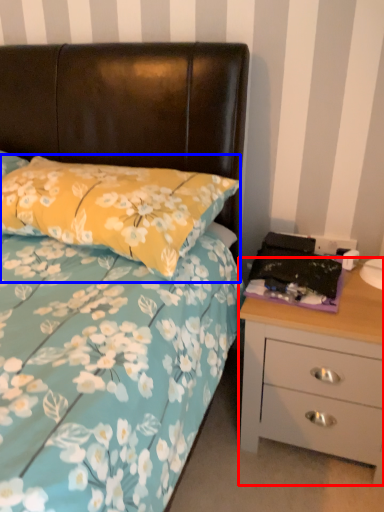
Question: Which object is further to the camera taking this photo, chest of drawers (highlighted by a red box) or pillow (highlighted by a blue box)?

Choices:
 (A) chest of drawers
 (B) pillow

Answer: (A)